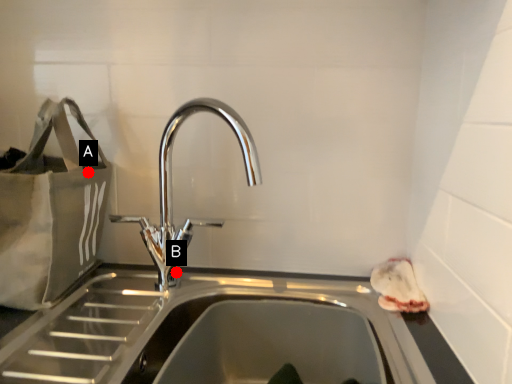
Question: Two points are circled on the image, labeled by A and B beside each circle. Which of the following is the farthest from the observer?

Choices:
 (A) A is further
 (B) B is further

Answer: (B)